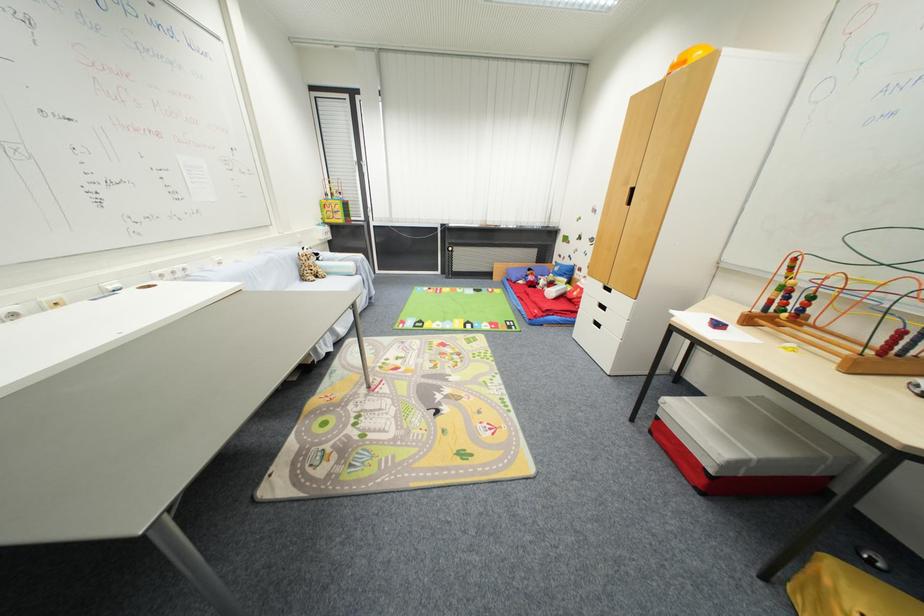
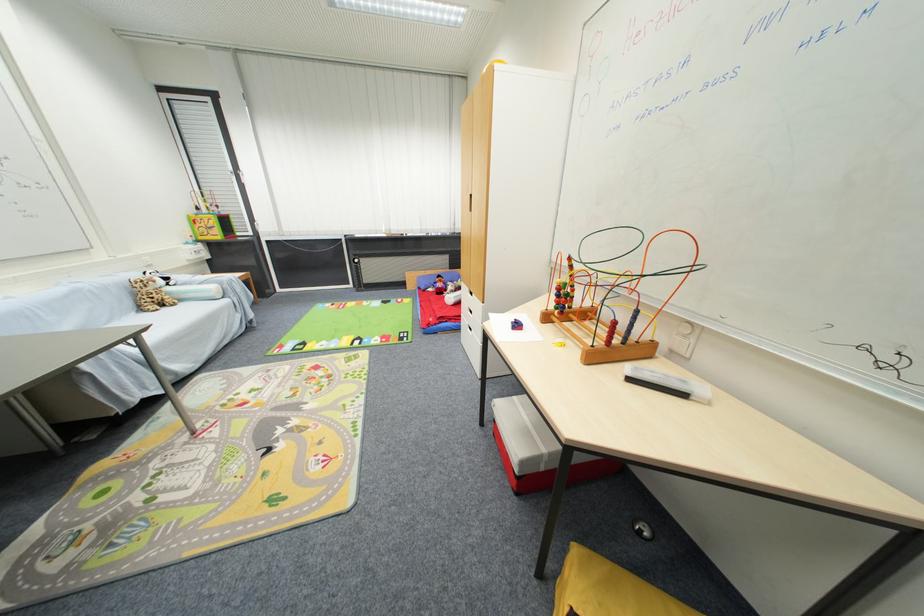
In the second image, find the point that corresponds to (345,222) in the first image.

(223, 238)